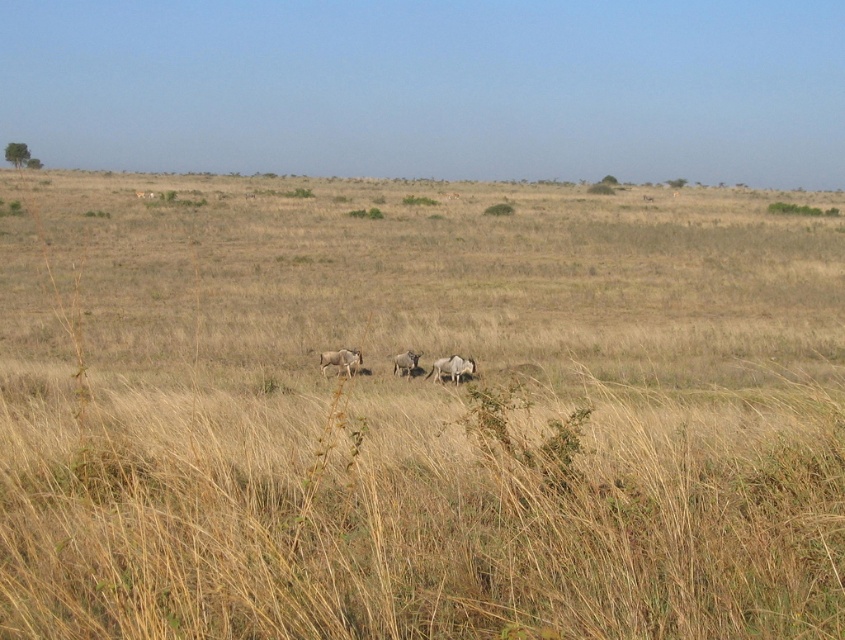
Who is positioned more to the left, dry grass at center or grayish-brown fur zebra at center?

Positioned to the left is dry grass at center.

Between point (476, 608) and point (401, 356), which one is positioned in front?

Point (476, 608) is more forward.

At what (x,y) coordinates should I click in order to perform the action: click on dry grass at center. Please return your answer as a coordinate pair (x, y). Looking at the image, I should click on (416, 412).

Between grayish-brown fur antelope at center and grayish-brown fur zebra at center, which one is positioned higher?

Positioned higher is grayish-brown fur zebra at center.

Is grayish-brown fur antelope at center thinner than grayish-brown fur zebra at center?

No.

Does point (464, 362) lie in front of point (402, 364)?

Yes, point (464, 362) is in front of point (402, 364).

Where is `grayish-brown fur antelope at center`? The height and width of the screenshot is (640, 845). grayish-brown fur antelope at center is located at coordinates (451, 368).

Who is shorter, dry grass at center or grayish-brown fur at center?

Standing shorter between the two is grayish-brown fur at center.

Is dry grass at center wider than grayish-brown fur at center?

Correct, the width of dry grass at center exceeds that of grayish-brown fur at center.

Is point (674, 214) less distant than point (333, 362)?

That is False.

At what (x,y) coordinates should I click in order to perform the action: click on dry grass at center. Please return your answer as a coordinate pair (x, y). Looking at the image, I should click on click(x=416, y=412).